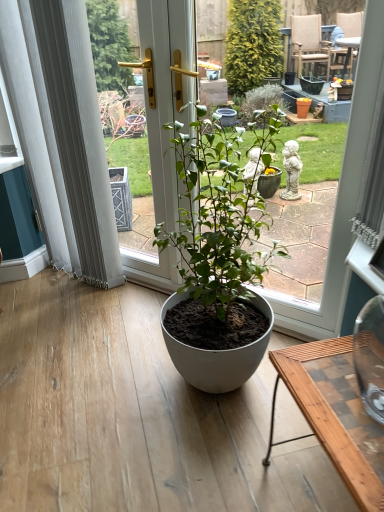
Image resolution: width=384 pixels, height=512 pixels. I want to click on free location to the left of matte white pot at center, so click(x=108, y=371).